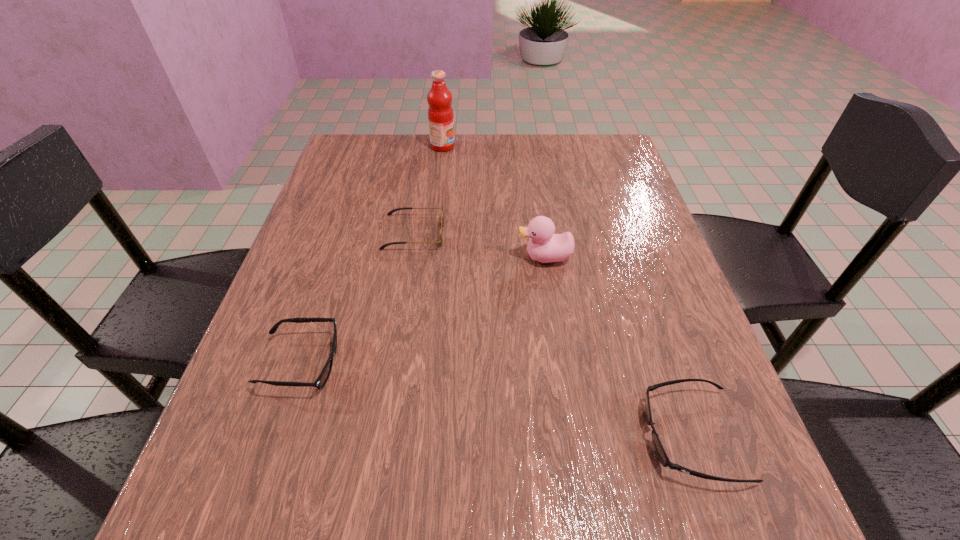
Find the location of `sunglasses that stands as the closest to the farthest sunglasses`. sunglasses that stands as the closest to the farthest sunglasses is located at coordinates pos(322,379).